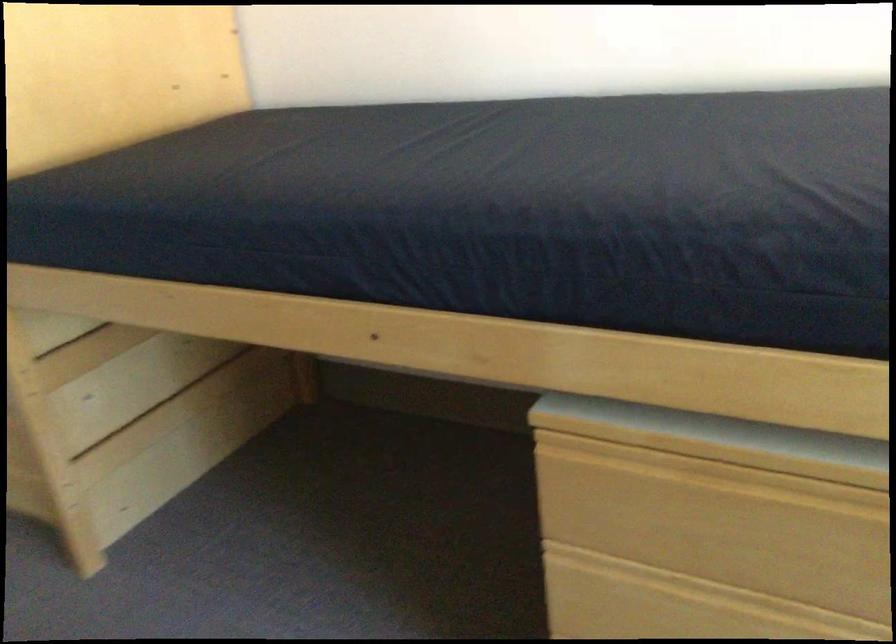
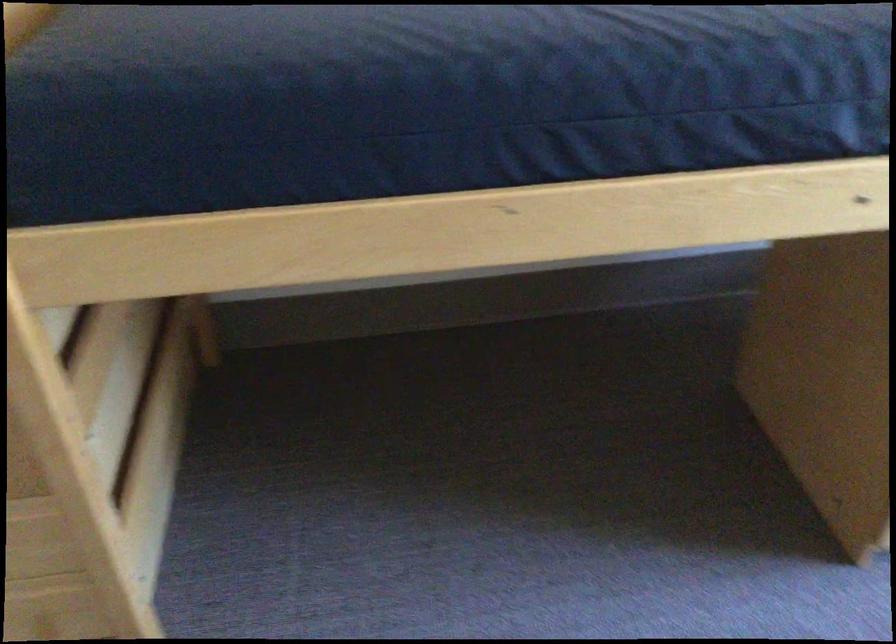
In the second image, find the point that corresponds to the point at 81,220 in the first image.

(280, 106)